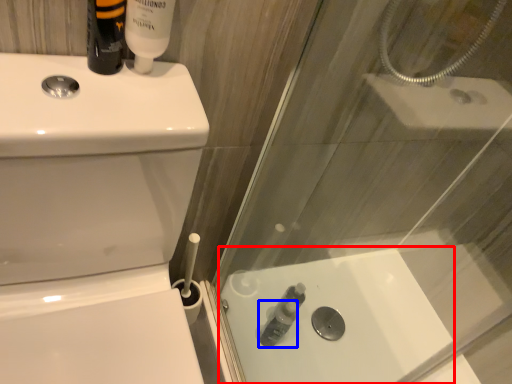
Question: Among these objects, which one is nearest to the camera, bath (highlighted by a red box) or toiletry (highlighted by a blue box)?

Choices:
 (A) bath
 (B) toiletry

Answer: (A)